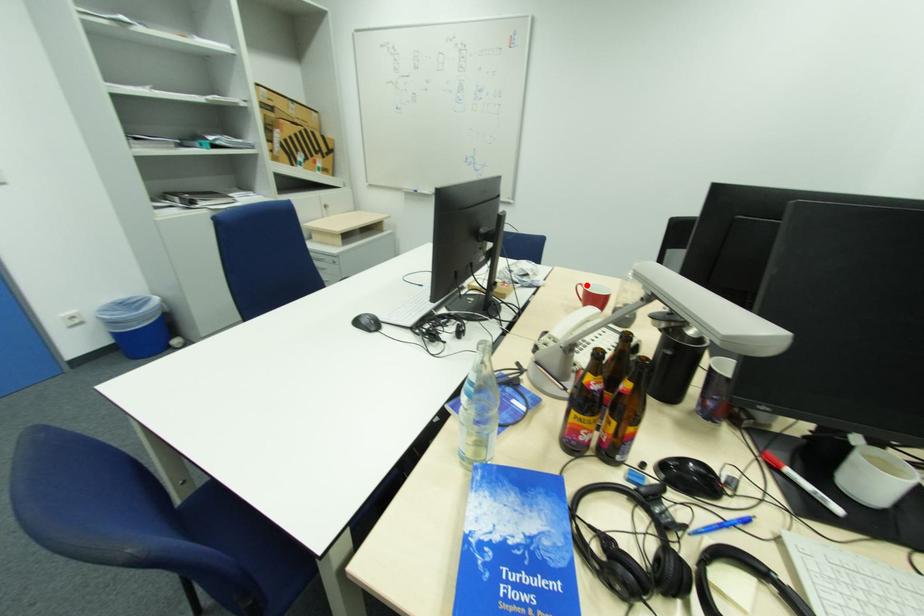
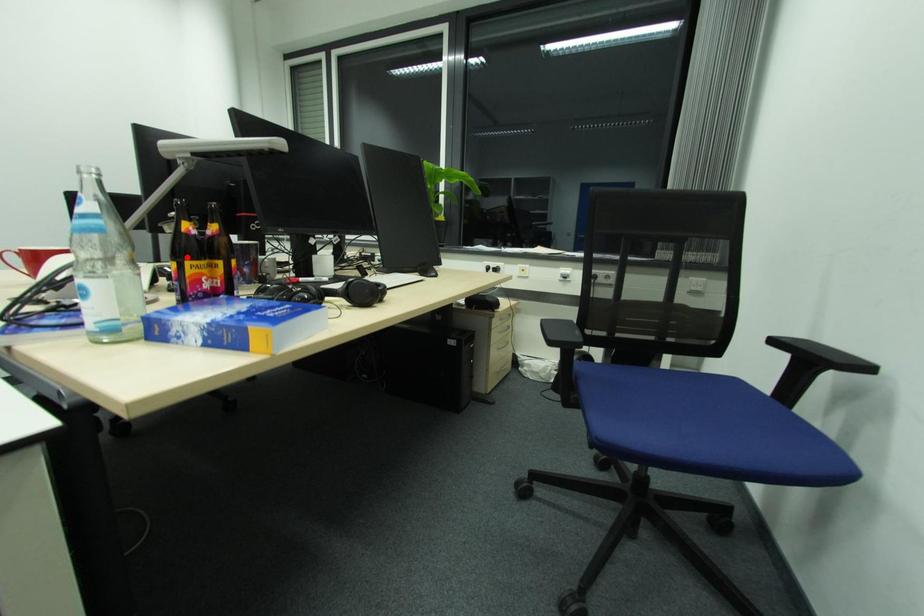
I am providing you with two images of the same scene from different viewpoints. A red point is marked on the first image and another point is marked on the second image. Are the points marked in image1 and image2 representing the same 3D position?

No